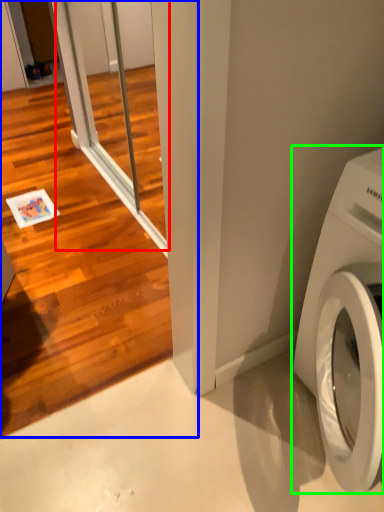
Question: Estimate the real-world distances between objects in this image. Which object is farther from screen door (highlighted by a red box), screen door (highlighted by a blue box) or washing machine (highlighted by a green box)?

Choices:
 (A) screen door
 (B) washing machine

Answer: (B)